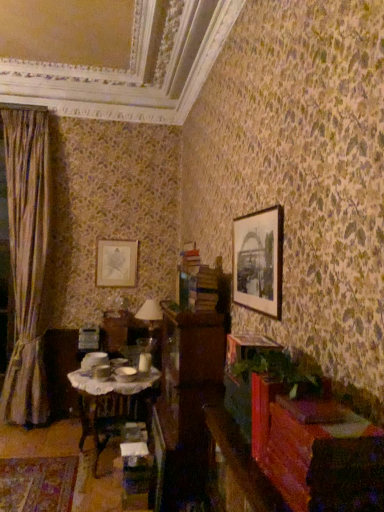
Question: Is matte black picture frame at upper right, the 2th picture frame in the back-to-front sequence, inside the boundaries of wooden table with lace cloth at center, or outside?

Choices:
 (A) outside
 (B) inside

Answer: (A)

Question: Based on their positions, is matte black picture frame at upper right, the 2th picture frame in the back-to-front sequence, located to the left or right of wooden table with lace cloth at center?

Choices:
 (A) right
 (B) left

Answer: (A)

Question: Estimate the real-world distances between objects in this image. Which object is farther from the wooden table with lace cloth at center?

Choices:
 (A) wooden dresser at center
 (B) matte gold picture frame at upper left, placed as the second picture frame when sorted from front to back
 (C) silky beige curtain at left
 (D) matte black picture frame at upper right, the 1th picture frame viewed from the front
 (E) matte glass table lamp at center

Answer: (D)

Question: Which object is positioned farthest from the wooden table with lace cloth at center?

Choices:
 (A) matte black picture frame at upper right, placed as the 1th picture frame when sorted from right to left
 (B) wooden dresser at center
 (C) matte glass table lamp at center
 (D) silky beige curtain at left
 (E) matte gold picture frame at upper left, the 2th picture frame from the right

Answer: (A)